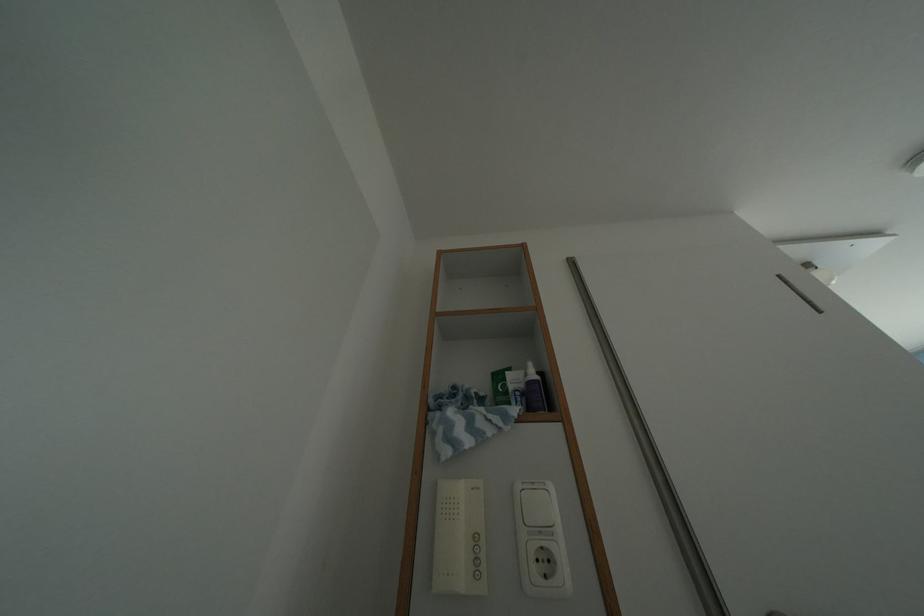
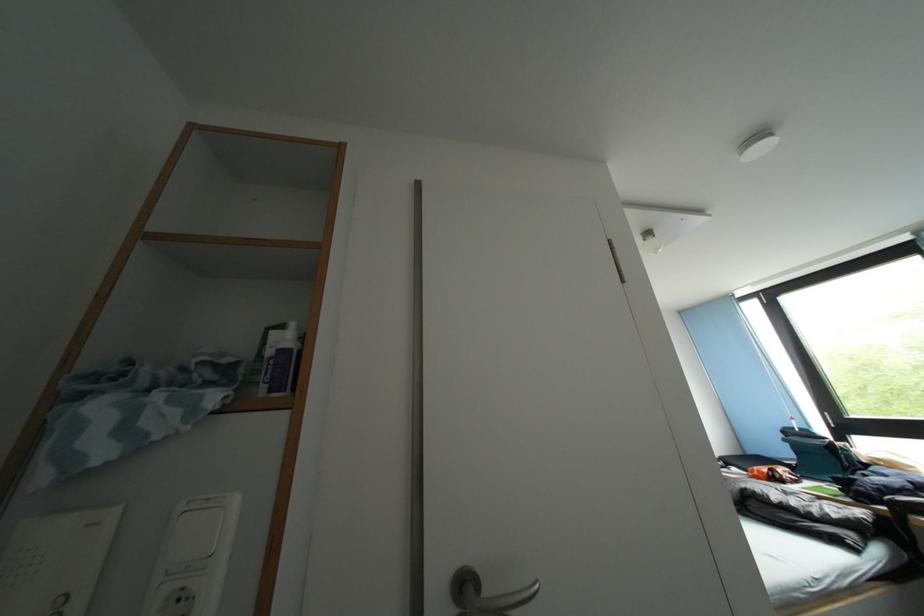
Locate, in the second image, the point that corresponds to (487,493) in the first image.

(107, 528)